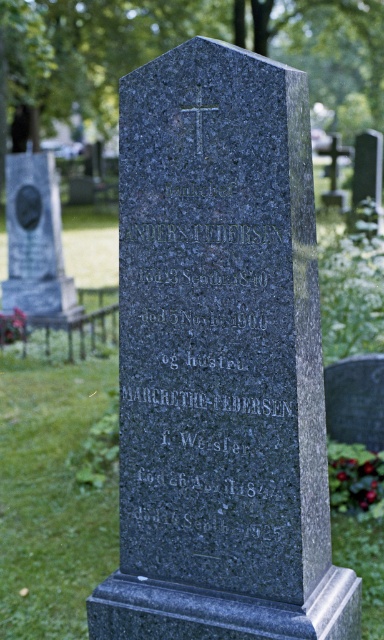
Question: Is granite gravestone at center positioned before polished marble gravestone at left?

Choices:
 (A) no
 (B) yes

Answer: (B)

Question: Is granite gravestone at center to the left of polished marble gravestone at left from the viewer's perspective?

Choices:
 (A) yes
 (B) no

Answer: (B)

Question: Which point is farther to the camera?

Choices:
 (A) granite gravestone at center
 (B) polished marble gravestone at left

Answer: (B)

Question: Does granite gravestone at center have a greater width compared to polished marble gravestone at left?

Choices:
 (A) yes
 (B) no

Answer: (A)

Question: Which object appears closest to the camera in this image?

Choices:
 (A) polished marble gravestone at left
 (B) granite gravestone at center

Answer: (B)